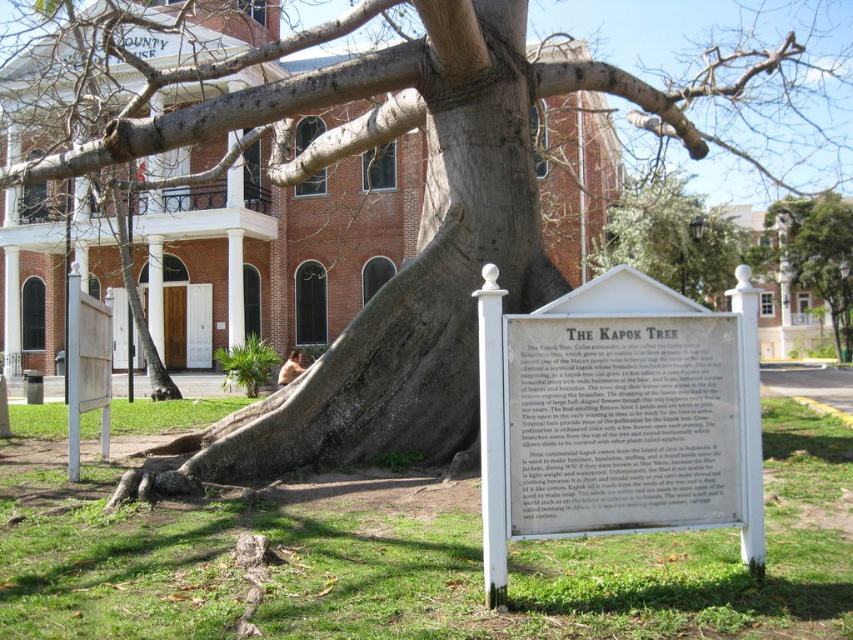
Question: Is white paper sign at center positioned at the back of green leafy tree at upper right?

Choices:
 (A) yes
 (B) no

Answer: (B)

Question: Is white wooden sign at center below white paper sign at center?

Choices:
 (A) yes
 (B) no

Answer: (A)

Question: Estimate the real-world distances between objects in this image. Which object is closer to the white paper sign at center?

Choices:
 (A) green leafy tree at upper right
 (B) brick building at center
 (C) green leafy tree at center
 (D) white wooden sign at center

Answer: (D)

Question: Which is farther from the brick building at center?

Choices:
 (A) white paper sign at center
 (B) green leafy tree at center

Answer: (A)

Question: Which point is closer to the camera?

Choices:
 (A) (570, 445)
 (B) (665, 269)

Answer: (A)

Question: Is brick building at center thinner than green leafy tree at upper right?

Choices:
 (A) yes
 (B) no

Answer: (B)